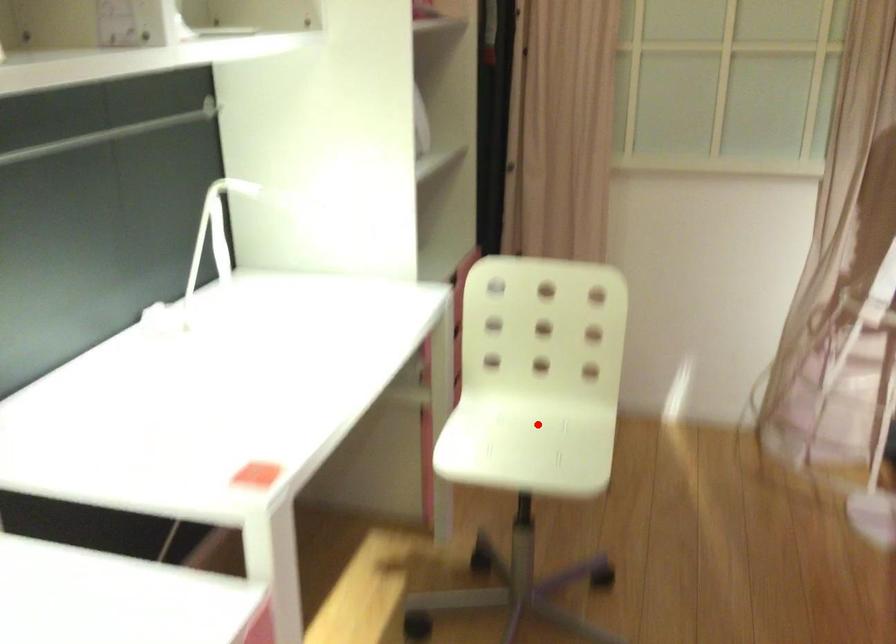
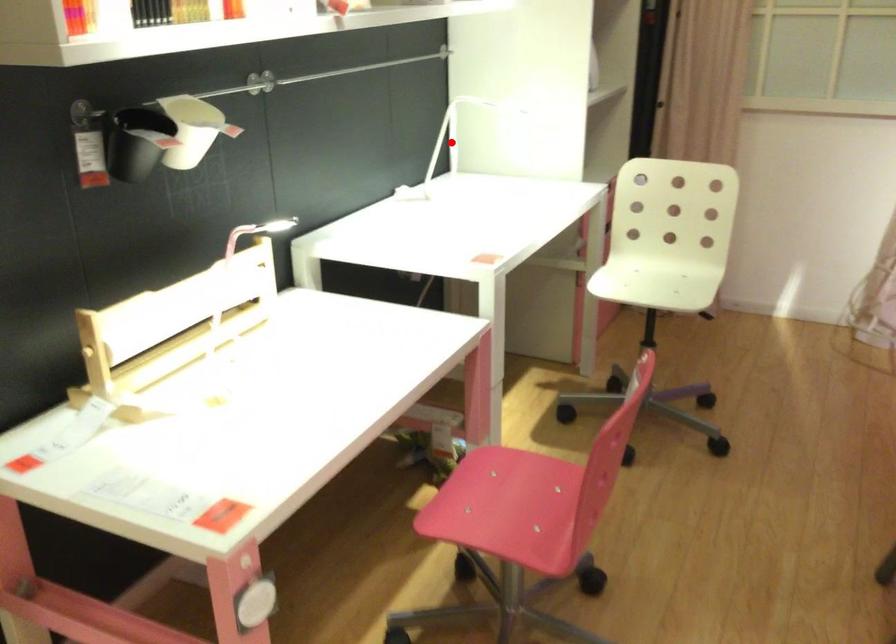
I am providing you with two images of the same scene from different viewpoints. A red point is marked on the first image and another point is marked on the second image. Is the marked point in image1 the same physical position as the marked point in image2?

No